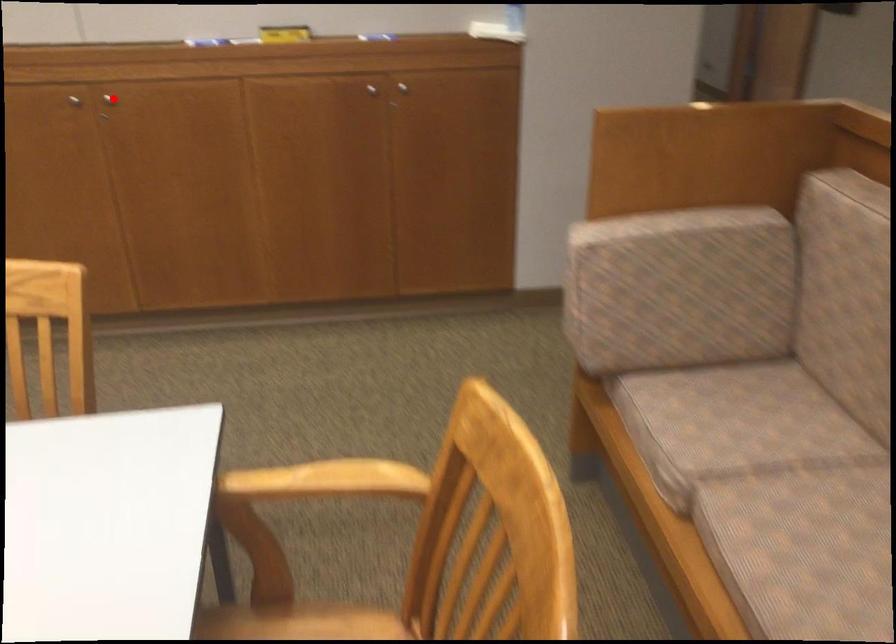
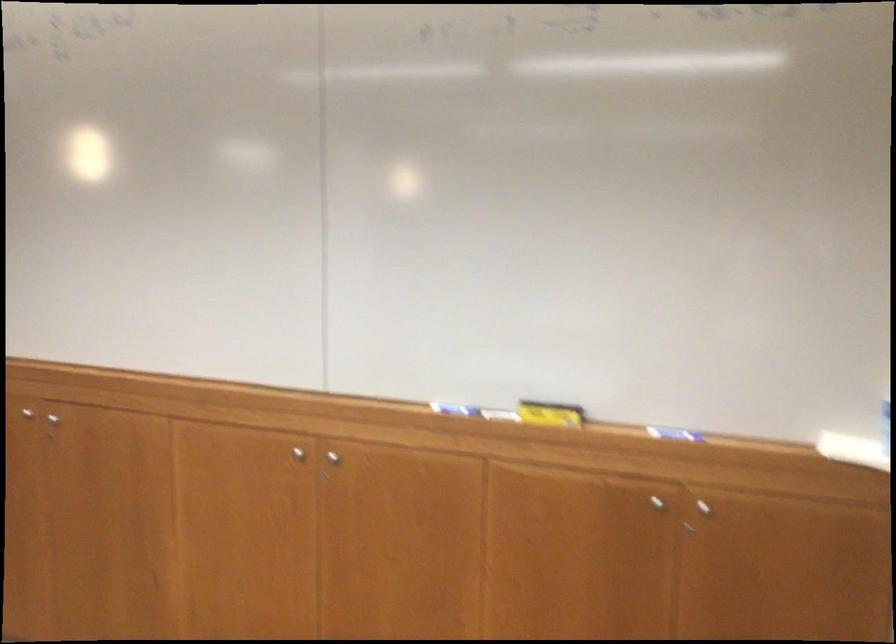
In the second image, find the point that corresponds to the highlighted location in the first image.

(332, 457)